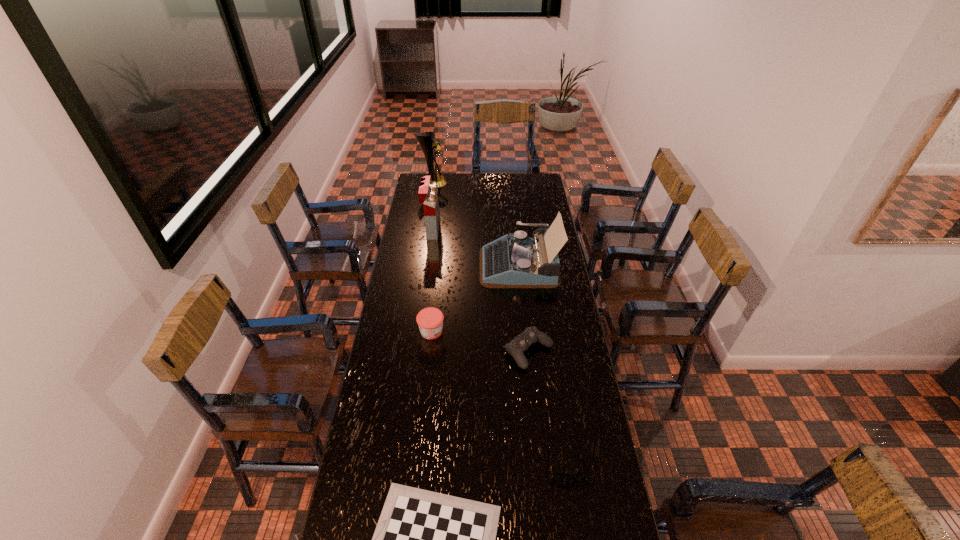
The height and width of the screenshot is (540, 960). I want to click on free spot located 0.120m on the typing side of the typewriter, so click(455, 265).

Where is `vacant space positioned 0.140m on the typing side of the typewriter`? vacant space positioned 0.140m on the typing side of the typewriter is located at coordinates (450, 265).

I want to click on free region located on the typing side of the typewriter, so click(x=457, y=265).

The image size is (960, 540). I want to click on vacant position located 0.390m on the front label of the fourth tallest object, so click(540, 332).

Find the location of a particular element. vacant space located on the left of the fifth tallest object is located at coordinates (441, 352).

Where is `free space located 0.150m on the front-facing side of the sixth farthest object`? free space located 0.150m on the front-facing side of the sixth farthest object is located at coordinates (580, 537).

Locate an element on the screen. Image resolution: width=960 pixels, height=540 pixels. object present at the far edge is located at coordinates (428, 144).

Locate an element on the screen. award that is positioned at the left edge is located at coordinates (428, 144).

The width and height of the screenshot is (960, 540). In order to click on cigarette case that is at the left edge in this screenshot , I will do `click(428, 194)`.

You are a GUI agent. You are given a task and a screenshot of the screen. Output one action in this format:
    pyautogui.click(x=<x>, y=<y>)
    Task: Click on the jam present at the left edge
    The height and width of the screenshot is (540, 960).
    Given the screenshot: What is the action you would take?
    pyautogui.click(x=430, y=320)